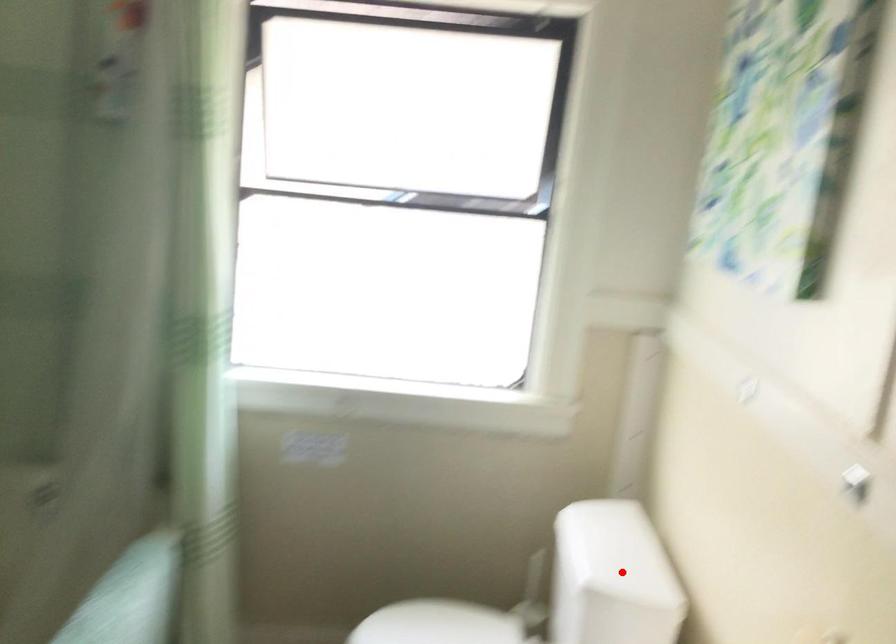
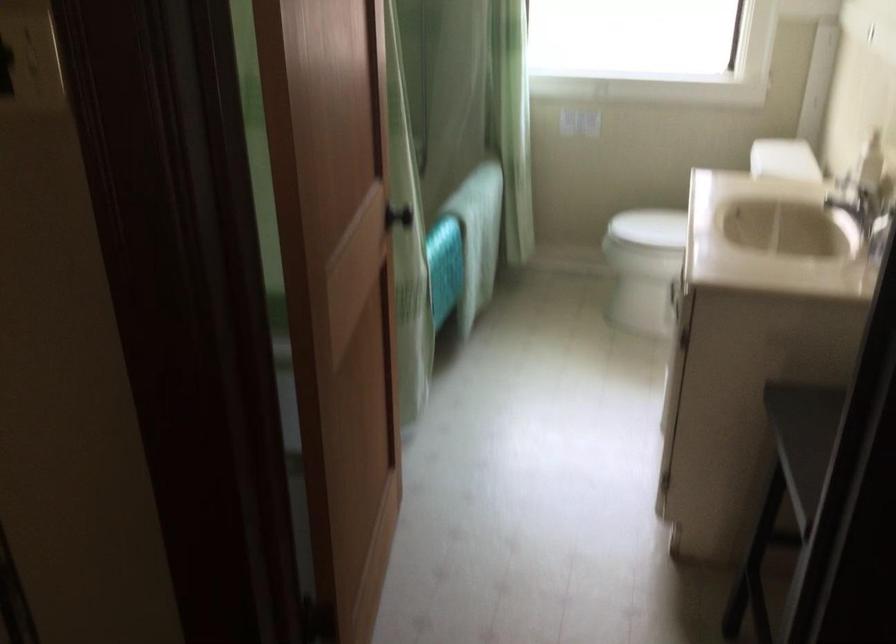
Question: A red point is marked in image1. In image2, is the corresponding 3D point closer to the camera or farther? Reply with the corresponding letter.

Choices:
 (A) The corresponding 3D point is closer.
 (B) The corresponding 3D point is farther.

Answer: (B)